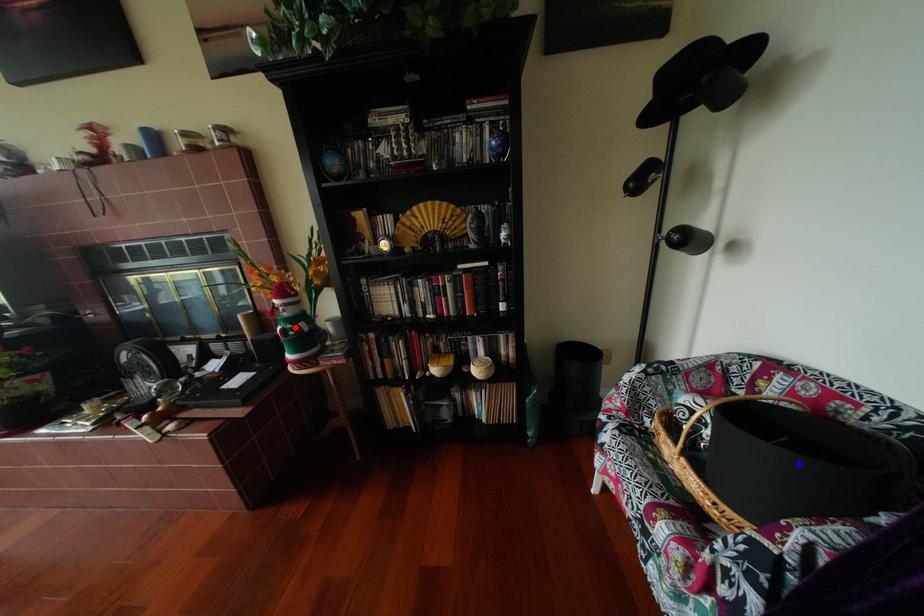
Question: Which of the two points in the image is closer to the camera?

Choices:
 (A) Blue point is closer.
 (B) Red point is closer.

Answer: (A)